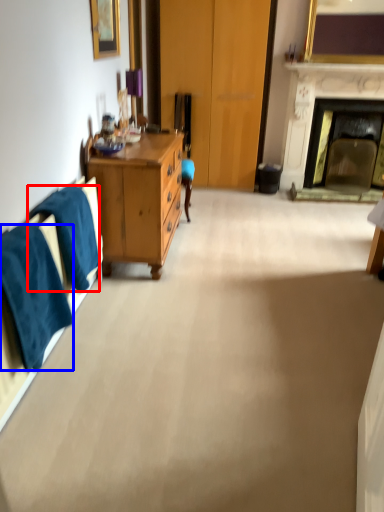
Question: Which object appears farthest to the camera in this image, towel/napkin (highlighted by a red box) or towel/napkin (highlighted by a blue box)?

Choices:
 (A) towel/napkin
 (B) towel/napkin

Answer: (A)